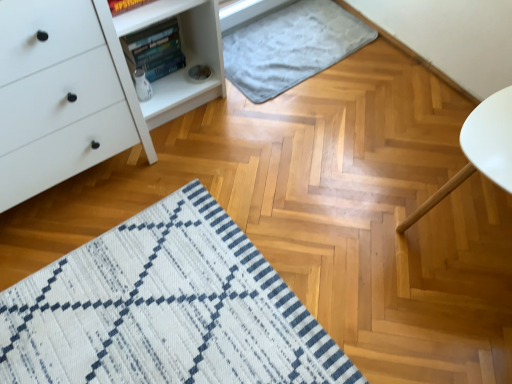
Question: Considering their positions, is white matte table at right located in front of or behind gray soft rug at upper center?

Choices:
 (A) front
 (B) behind

Answer: (A)

Question: Which is correct: white matte table at right is inside gray soft rug at upper center, or outside of it?

Choices:
 (A) outside
 (B) inside

Answer: (A)

Question: Estimate the real-world distances between objects in this image. Which object is farther from the hardcover book at upper left?

Choices:
 (A) white matte table at right
 (B) gray soft rug at upper center
 (C) white matte chest of drawers at left

Answer: (A)

Question: Considering the real-world distances, which object is farthest from the white matte table at right?

Choices:
 (A) hardcover book at upper left
 (B) gray soft rug at upper center
 (C) white matte chest of drawers at left

Answer: (A)